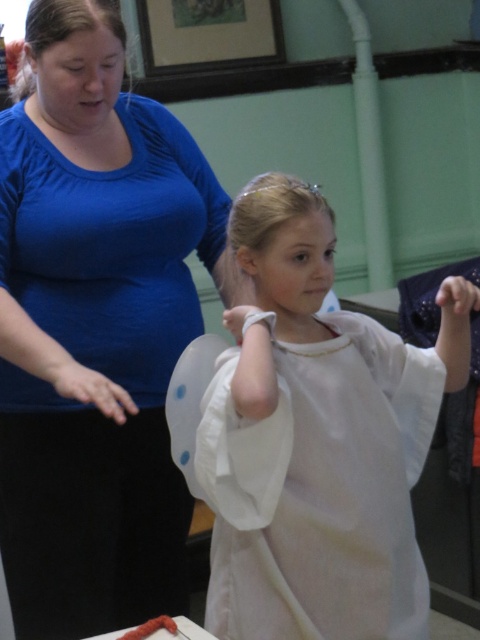
Question: Observing the image, what is the correct spatial positioning of blue matte shirt at upper left in reference to white cotton dress at center?

Choices:
 (A) right
 (B) left

Answer: (B)

Question: Is the position of blue matte shirt at upper left less distant than that of white cotton dress at center?

Choices:
 (A) no
 (B) yes

Answer: (A)

Question: Which object is farther from the camera taking this photo?

Choices:
 (A) white cotton dress at center
 (B) blue matte shirt at upper left

Answer: (B)

Question: Which of the following is the farthest from the observer?

Choices:
 (A) white cotton dress at center
 (B) blue matte shirt at upper left

Answer: (B)

Question: Observing the image, what is the correct spatial positioning of blue matte shirt at upper left in reference to white cotton dress at center?

Choices:
 (A) below
 (B) above

Answer: (B)

Question: Which point appears closest to the camera in this image?

Choices:
 (A) (38, 280)
 (B) (381, 612)

Answer: (B)